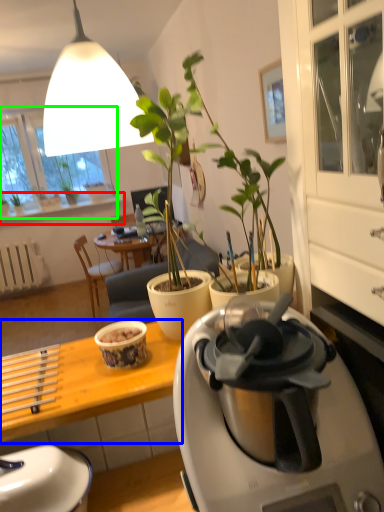
Question: Estimate the real-world distances between objects in this image. Which object is closer to window sill (highlighted by a red box), desk (highlighted by a blue box) or window screen (highlighted by a green box)?

Choices:
 (A) desk
 (B) window screen

Answer: (B)